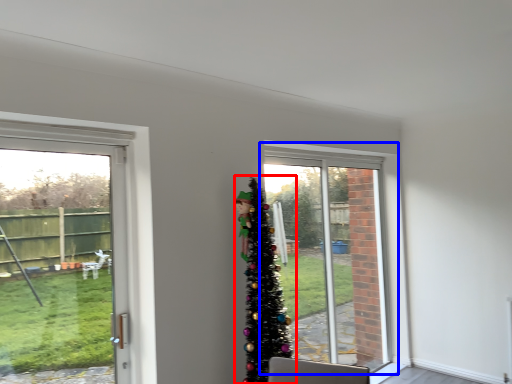
Question: Among these objects, which one is nearest to the camera, christmas tree (highlighted by a red box) or window (highlighted by a blue box)?

Choices:
 (A) christmas tree
 (B) window

Answer: (A)